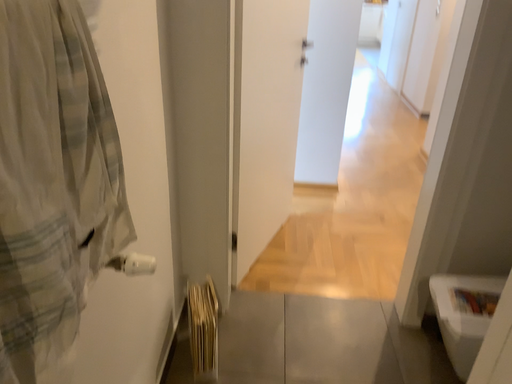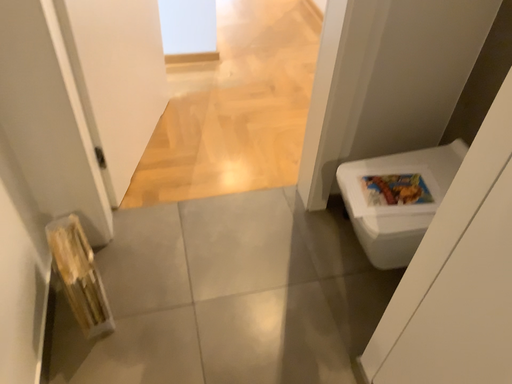
Question: Which way did the camera rotate in the video?

Choices:
 (A) rotated left
 (B) rotated right

Answer: (B)